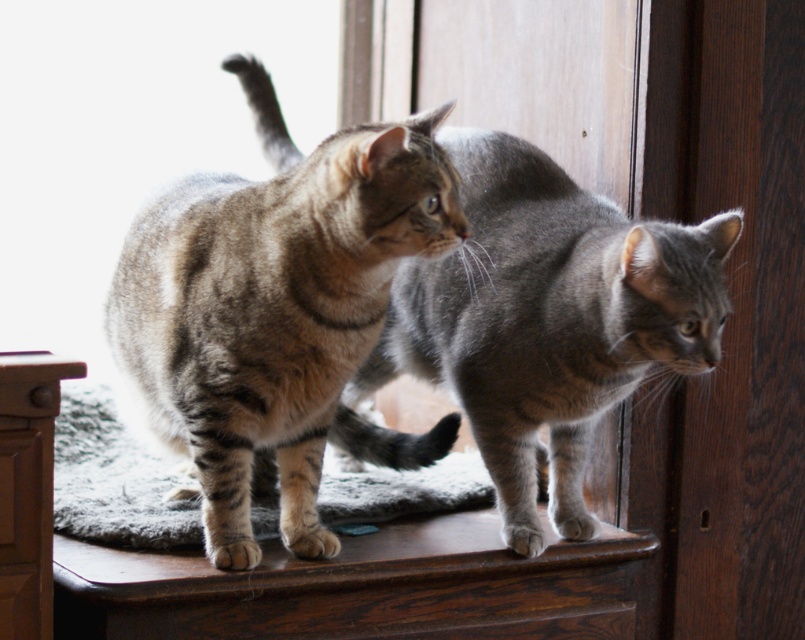
You are a photographer aiming to capture both cats in a single shot. Given the tabby fur cat at center is at point 0.498, 0.348, where should you position your camera to ensure both cats are in frame?

To capture both cats in a single shot, position your camera so it can cover the area where the tabby fur cat at center is located at point [279,317], ensuring the other cat is also within the frame.

You are a photographer trying to capture both cats in a single shot. Given that your camera can only focus on objects within a 1 meter width, and both cats are positioned on the wooden surface, will the tabby fur cat at center and the gray tabby cat at center fit within the frame?

The tabby fur cat at center has a lesser width compared to gray tabby cat at center. Since the total width of both cats combined may exceed 1 meter, it is uncertain if they will fit within the frame. The photographer should check the combined width to ensure it does not surpass the 1 meter limit.